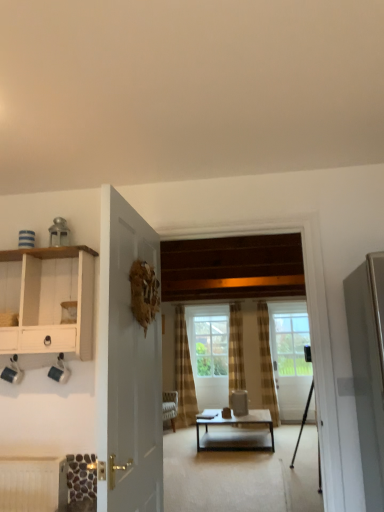
Question: Does clear glass door at center, acting as the 2th door starting from the front, appear on the right side of matte black coffee table at center?

Choices:
 (A) no
 (B) yes

Answer: (B)

Question: Can you confirm if clear glass door at center, acting as the 2th door starting from the front, is thinner than matte black coffee table at center?

Choices:
 (A) yes
 (B) no

Answer: (A)

Question: From the image's perspective, is clear glass door at center, positioned as the first door in right-to-left order, below matte black coffee table at center?

Choices:
 (A) no
 (B) yes

Answer: (A)

Question: Considering the relative sizes of clear glass door at center, positioned as the second door in left-to-right order, and matte black coffee table at center in the image provided, is clear glass door at center, positioned as the second door in left-to-right order, bigger than matte black coffee table at center?

Choices:
 (A) yes
 (B) no

Answer: (B)

Question: Is clear glass door at center, acting as the 2th door starting from the front, looking in the opposite direction of matte black coffee table at center?

Choices:
 (A) no
 (B) yes

Answer: (A)

Question: Considering the positions of clear glass window at center and matte black coffee table at center in the image, is clear glass window at center wider or thinner than matte black coffee table at center?

Choices:
 (A) wide
 (B) thin

Answer: (B)

Question: Looking at the image, does clear glass window at center seem bigger or smaller compared to matte black coffee table at center?

Choices:
 (A) big
 (B) small

Answer: (B)

Question: From the image's perspective, is clear glass window at center located above or below matte black coffee table at center?

Choices:
 (A) below
 (B) above

Answer: (B)

Question: Considering their positions, is clear glass window at center located in front of or behind matte black coffee table at center?

Choices:
 (A) front
 (B) behind

Answer: (B)

Question: Considering their positions, is matte black coffee table at center located in front of or behind metallic tripod at center?

Choices:
 (A) behind
 (B) front

Answer: (A)

Question: Looking at the image, does matte black coffee table at center seem bigger or smaller compared to metallic tripod at center?

Choices:
 (A) big
 (B) small

Answer: (B)

Question: Considering the positions of matte black coffee table at center and metallic tripod at center in the image, is matte black coffee table at center taller or shorter than metallic tripod at center?

Choices:
 (A) short
 (B) tall

Answer: (A)

Question: Choose the correct answer: Is matte black coffee table at center inside metallic tripod at center or outside it?

Choices:
 (A) outside
 (B) inside

Answer: (A)

Question: Choose the correct answer: Is plaid fabric curtain at center inside white wood cabinet at left or outside it?

Choices:
 (A) inside
 (B) outside

Answer: (B)

Question: Is plaid fabric curtain at center to the left or to the right of white wood cabinet at left in the image?

Choices:
 (A) left
 (B) right

Answer: (B)